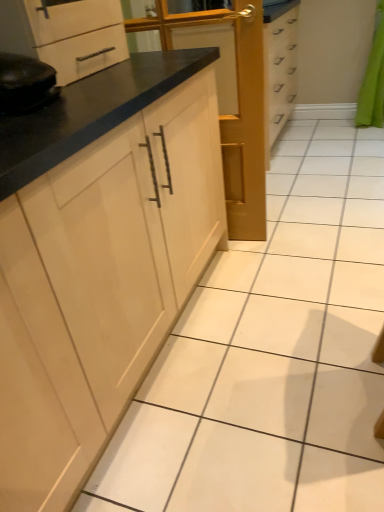
Measure the distance between matte wood screen door at center and camera.

matte wood screen door at center is 1.54 meters from camera.

In order to face matte wood screen door at center, should I rotate leftwards or rightwards?

To align with it, rotate left about 1.504°.

Locate an element on the screen. matte wood screen door at center is located at coordinates (221, 88).

What do you see at coordinates (221, 88) in the screenshot?
I see `matte wood screen door at center` at bounding box center [221, 88].

This screenshot has height=512, width=384. In order to click on matte wood screen door at center in this screenshot , I will do `click(221, 88)`.